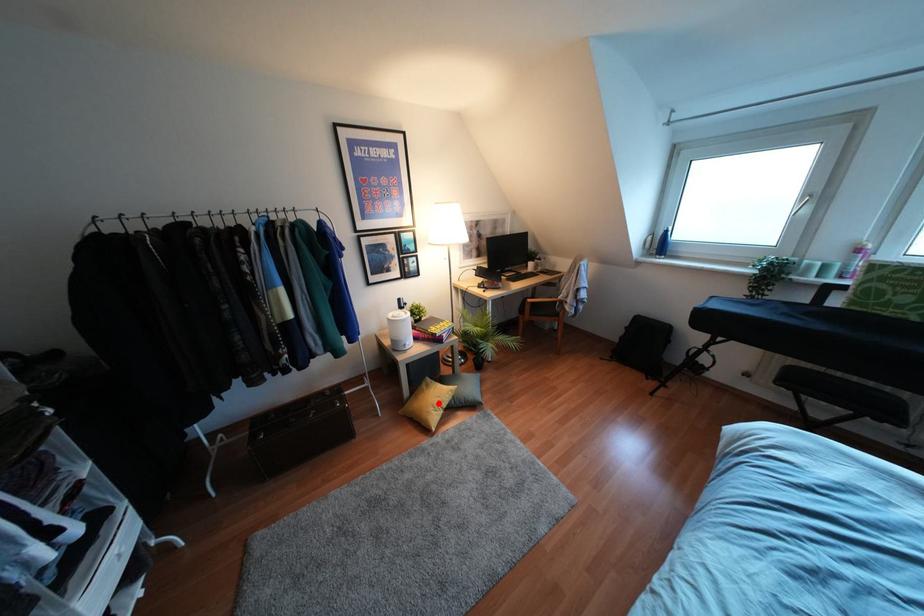
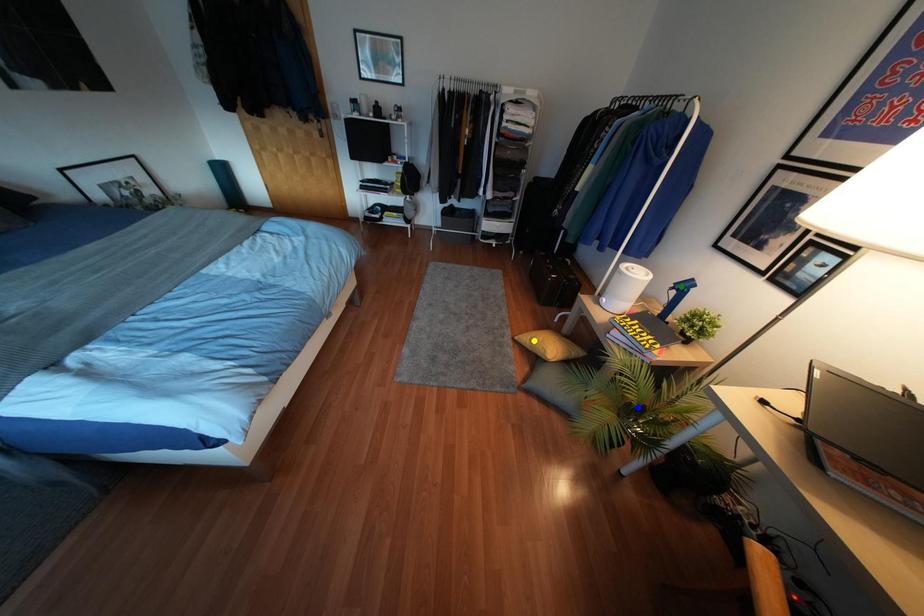
Question: I am providing you with two images of the same scene from different viewpoints. A red point is marked on the first image. You are given multiple points on the second image. Which mark in image 2 goes with the point in image 1?

Choices:
 (A) green point
 (B) yellow point
 (C) blue point

Answer: (B)